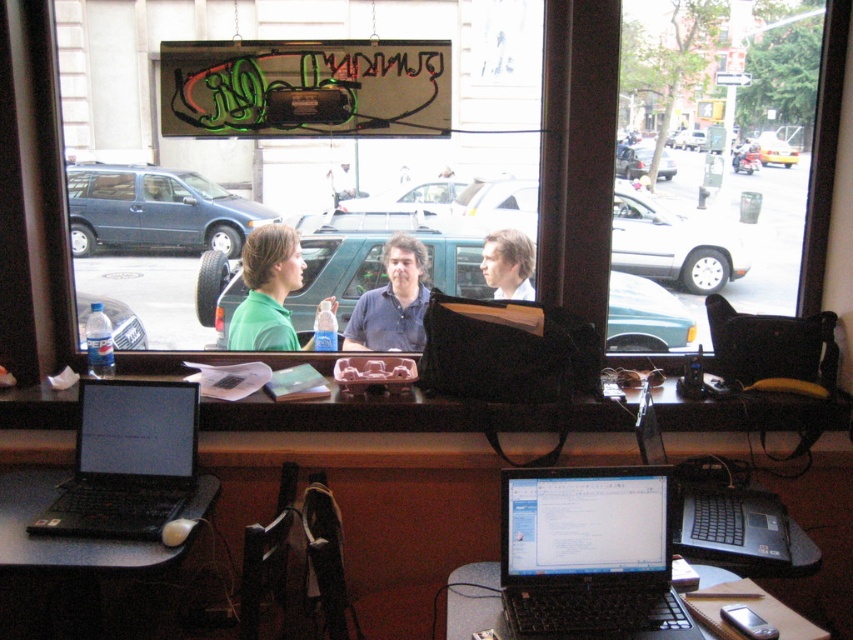
You are a customer entering the cafe and want to sit at the black plastic table at center. However, there is a person with smooth brown hair at center in your way. Can you walk around them to reach the table?

The black plastic table at center is positioned on the right side of smooth brown hair at center, so you can walk around the right side of smooth brown hair at center to reach the black plastic table at center.

You are standing at the counter in the cafe and want to walk to the table outside where the three people are sitting. There are two points marked on the floor at coordinates point (175, 435) and point (347, 324). Which point should you step on first to reach the table?

You should step on point (175, 435) first because it is in front of point (347, 324), meaning it is closer to your starting position at the counter.